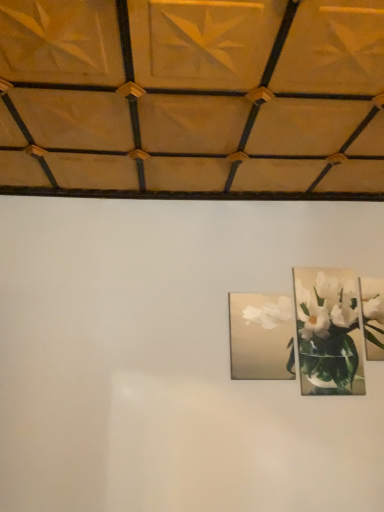
In order to face metallic silver picture frame at upper right, the third picture frame when ordered from left to right, should I rotate leftwards or rightwards?

It's best to rotate right around 25.051 degrees.

Where is `metallic silver frame at upper right, marked as the 2th picture frame in a right-to-left arrangement`? The height and width of the screenshot is (512, 384). metallic silver frame at upper right, marked as the 2th picture frame in a right-to-left arrangement is located at coordinates (328, 332).

Where is `metallic silver picture frame at upper right, the first picture frame when ordered from right to left`? metallic silver picture frame at upper right, the first picture frame when ordered from right to left is located at coordinates (373, 316).

Can you tell me how much matte silver picture frame at center, marked as the first picture frame in a left-to-right arrangement, and metallic silver picture frame at upper right, the third picture frame when ordered from left to right, differ in facing direction?

The facing directions of matte silver picture frame at center, marked as the first picture frame in a left-to-right arrangement, and metallic silver picture frame at upper right, the third picture frame when ordered from left to right, are 0.93 degrees apart.

From a real-world perspective, which object stands above the other?

metallic silver picture frame at upper right, the first picture frame when ordered from right to left, from a real-world perspective.

Is matte silver picture frame at center, which appears as the third picture frame when viewed from the right, at the right side of metallic silver picture frame at upper right, the third picture frame when ordered from left to right?

No.

Does matte silver picture frame at center, marked as the first picture frame in a left-to-right arrangement, turn towards metallic silver frame at upper right, which is the 2th picture frame in left-to-right order?

No, matte silver picture frame at center, marked as the first picture frame in a left-to-right arrangement, is not oriented towards metallic silver frame at upper right, which is the 2th picture frame in left-to-right order.

Is point (284, 302) closer to viewer compared to point (317, 311)?

That is True.

Which object is further away from the camera, matte silver picture frame at center, marked as the first picture frame in a left-to-right arrangement, or metallic silver frame at upper right, marked as the 2th picture frame in a right-to-left arrangement?

metallic silver frame at upper right, marked as the 2th picture frame in a right-to-left arrangement, is further from the camera.

From a real-world perspective, which object rests below the other?

From a 3D spatial view, matte silver picture frame at center, marked as the first picture frame in a left-to-right arrangement, is below.

Is metallic silver frame at upper right, marked as the 2th picture frame in a right-to-left arrangement, smaller than matte silver picture frame at center, marked as the first picture frame in a left-to-right arrangement?

Actually, metallic silver frame at upper right, marked as the 2th picture frame in a right-to-left arrangement, might be larger than matte silver picture frame at center, marked as the first picture frame in a left-to-right arrangement.

From a real-world perspective, is metallic silver frame at upper right, marked as the 2th picture frame in a right-to-left arrangement, physically above matte silver picture frame at center, which appears as the third picture frame when viewed from the right?

Correct, in the physical world, metallic silver frame at upper right, marked as the 2th picture frame in a right-to-left arrangement, is higher than matte silver picture frame at center, which appears as the third picture frame when viewed from the right.

Can you tell me how much metallic silver frame at upper right, marked as the 2th picture frame in a right-to-left arrangement, and matte silver picture frame at center, marked as the first picture frame in a left-to-right arrangement, differ in facing direction?

0.174 degrees separate the facing orientations of metallic silver frame at upper right, marked as the 2th picture frame in a right-to-left arrangement, and matte silver picture frame at center, marked as the first picture frame in a left-to-right arrangement.

Considering the sizes of metallic silver frame at upper right, marked as the 2th picture frame in a right-to-left arrangement, and matte silver picture frame at center, marked as the first picture frame in a left-to-right arrangement, in the image, is metallic silver frame at upper right, marked as the 2th picture frame in a right-to-left arrangement, taller or shorter than matte silver picture frame at center, marked as the first picture frame in a left-to-right arrangement,?

metallic silver frame at upper right, marked as the 2th picture frame in a right-to-left arrangement, is taller than matte silver picture frame at center, marked as the first picture frame in a left-to-right arrangement.

Is metallic silver picture frame at upper right, the first picture frame when ordered from right to left, touching metallic silver frame at upper right, marked as the 2th picture frame in a right-to-left arrangement?

No, metallic silver picture frame at upper right, the first picture frame when ordered from right to left, is not making contact with metallic silver frame at upper right, marked as the 2th picture frame in a right-to-left arrangement.

Considering the relative positions of metallic silver picture frame at upper right, the first picture frame when ordered from right to left, and metallic silver frame at upper right, which is the 2th picture frame in left-to-right order, in the image provided, is metallic silver picture frame at upper right, the first picture frame when ordered from right to left, behind metallic silver frame at upper right, which is the 2th picture frame in left-to-right order,?

Yes, it is.

Can you confirm if metallic silver picture frame at upper right, the third picture frame when ordered from left to right, is wider than metallic silver frame at upper right, marked as the 2th picture frame in a right-to-left arrangement?

Yes, metallic silver picture frame at upper right, the third picture frame when ordered from left to right, is wider than metallic silver frame at upper right, marked as the 2th picture frame in a right-to-left arrangement.

Relative to metallic silver picture frame at upper right, the third picture frame when ordered from left to right, is metallic silver frame at upper right, marked as the 2th picture frame in a right-to-left arrangement, in front or behind?

In the image, metallic silver frame at upper right, marked as the 2th picture frame in a right-to-left arrangement, appears in front of metallic silver picture frame at upper right, the third picture frame when ordered from left to right.

Is metallic silver frame at upper right, marked as the 2th picture frame in a right-to-left arrangement, inside the boundaries of metallic silver picture frame at upper right, the first picture frame when ordered from right to left, or outside?

metallic silver frame at upper right, marked as the 2th picture frame in a right-to-left arrangement, is not inside metallic silver picture frame at upper right, the first picture frame when ordered from right to left, it's outside.

Is metallic silver frame at upper right, which is the 2th picture frame in left-to-right order, shorter than metallic silver picture frame at upper right, the first picture frame when ordered from right to left?

No.

Is metallic silver picture frame at upper right, the first picture frame when ordered from right to left, facing away from matte silver picture frame at center, which appears as the third picture frame when viewed from the right?

No, metallic silver picture frame at upper right, the first picture frame when ordered from right to left,'s orientation is not away from matte silver picture frame at center, which appears as the third picture frame when viewed from the right.

The image size is (384, 512). What are the coordinates of `the 2nd picture frame below the metallic silver picture frame at upper right, the first picture frame when ordered from right to left (from the image's perspective)` in the screenshot? It's located at (261, 336).

Is metallic silver picture frame at upper right, the third picture frame when ordered from left to right, located outside matte silver picture frame at center, marked as the first picture frame in a left-to-right arrangement?

metallic silver picture frame at upper right, the third picture frame when ordered from left to right, lies outside matte silver picture frame at center, marked as the first picture frame in a left-to-right arrangement,'s area.

From a real-world perspective, between metallic silver picture frame at upper right, the first picture frame when ordered from right to left, and matte silver picture frame at center, marked as the first picture frame in a left-to-right arrangement, who is vertically lower?

matte silver picture frame at center, marked as the first picture frame in a left-to-right arrangement, from a real-world perspective.

Identify the location of the 2nd picture frame counting from the right of the matte silver picture frame at center, which appears as the third picture frame when viewed from the right. (373, 316).

Identify the location of picture frame lying in front of the metallic silver frame at upper right, which is the 2th picture frame in left-to-right order. (261, 336).

Estimate the real-world distances between objects in this image. Which object is further from metallic silver picture frame at upper right, the third picture frame when ordered from left to right, matte silver picture frame at center, marked as the first picture frame in a left-to-right arrangement, or metallic silver frame at upper right, marked as the 2th picture frame in a right-to-left arrangement?

matte silver picture frame at center, marked as the first picture frame in a left-to-right arrangement, is further to metallic silver picture frame at upper right, the third picture frame when ordered from left to right.

From the image, which object appears to be nearer to matte silver picture frame at center, which appears as the third picture frame when viewed from the right, metallic silver frame at upper right, which is the 2th picture frame in left-to-right order, or metallic silver picture frame at upper right, the first picture frame when ordered from right to left?

metallic silver frame at upper right, which is the 2th picture frame in left-to-right order, is positioned closer to the anchor matte silver picture frame at center, which appears as the third picture frame when viewed from the right.

Looking at the image, which one is located further to metallic silver picture frame at upper right, the third picture frame when ordered from left to right, metallic silver frame at upper right, which is the 2th picture frame in left-to-right order, or matte silver picture frame at center, which appears as the third picture frame when viewed from the right?

The object further to metallic silver picture frame at upper right, the third picture frame when ordered from left to right, is matte silver picture frame at center, which appears as the third picture frame when viewed from the right.

Looking at the image, which one is located further to metallic silver frame at upper right, which is the 2th picture frame in left-to-right order, metallic silver picture frame at upper right, the third picture frame when ordered from left to right, or matte silver picture frame at center, marked as the first picture frame in a left-to-right arrangement?

The object further to metallic silver frame at upper right, which is the 2th picture frame in left-to-right order, is matte silver picture frame at center, marked as the first picture frame in a left-to-right arrangement.

Based on their spatial positions, is metallic silver picture frame at upper right, the third picture frame when ordered from left to right, or metallic silver frame at upper right, which is the 2th picture frame in left-to-right order, further from matte silver picture frame at center, marked as the first picture frame in a left-to-right arrangement?

metallic silver picture frame at upper right, the third picture frame when ordered from left to right, is positioned further to the anchor matte silver picture frame at center, marked as the first picture frame in a left-to-right arrangement.

Based on their spatial positions, is matte silver picture frame at center, which appears as the third picture frame when viewed from the right, or metallic silver picture frame at upper right, the first picture frame when ordered from right to left, closer to metallic silver frame at upper right, marked as the 2th picture frame in a right-to-left arrangement?

The object closer to metallic silver frame at upper right, marked as the 2th picture frame in a right-to-left arrangement, is metallic silver picture frame at upper right, the first picture frame when ordered from right to left.

The image size is (384, 512). Identify the location of picture frame located between matte silver picture frame at center, marked as the first picture frame in a left-to-right arrangement, and metallic silver picture frame at upper right, the first picture frame when ordered from right to left, in the left-right direction. pos(328,332).